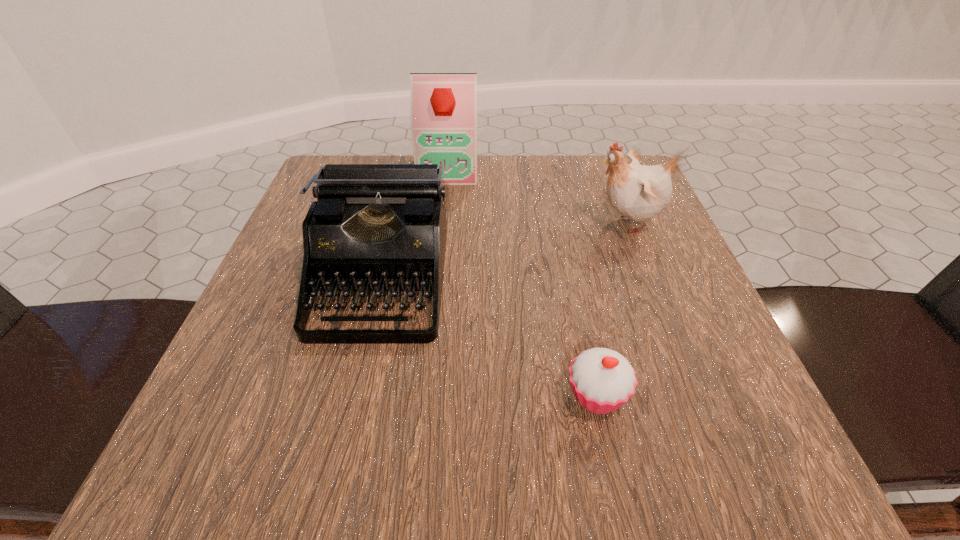
Identify the location of vacant point located 0.220m at the beak of the rightmost object. The image size is (960, 540). (480, 223).

I want to click on vacant point located 0.080m on the typing side of the third tallest object, so (x=352, y=390).

Find the location of `free space located on the back of the shortest object`. free space located on the back of the shortest object is located at coordinates (560, 225).

I want to click on soya milk that is at the far edge, so click(x=443, y=116).

Where is `bird that is positioned at the far edge`? The height and width of the screenshot is (540, 960). bird that is positioned at the far edge is located at coordinates (639, 192).

The height and width of the screenshot is (540, 960). Find the location of `object at the near edge`. object at the near edge is located at coordinates (602, 380).

At what (x,y) coordinates should I click in order to perform the action: click on object located at the left edge. Please return your answer as a coordinate pair (x, y). This screenshot has width=960, height=540. Looking at the image, I should click on (375, 227).

You are a GUI agent. You are given a task and a screenshot of the screen. Output one action in this format:
    pyautogui.click(x=<x>, y=<y>)
    Task: Click on the object positioned at the right edge
    Image resolution: width=960 pixels, height=540 pixels.
    Given the screenshot: What is the action you would take?
    pyautogui.click(x=639, y=192)

Where is `object that is at the far right corner`? This screenshot has height=540, width=960. object that is at the far right corner is located at coordinates (639, 192).

This screenshot has height=540, width=960. I want to click on vacant area at the far edge, so click(550, 171).